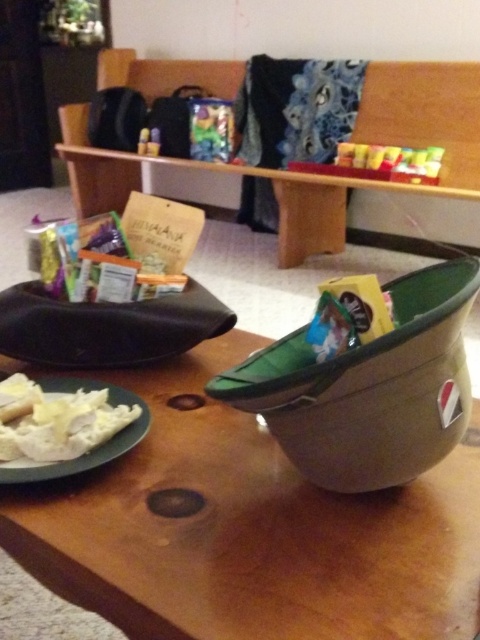
How far apart are brown matte bowl at center and matte black camera at upper center?

They are 8.12 feet apart.

Does brown matte bowl at center have a lesser width compared to matte black camera at upper center?

No.

This screenshot has height=640, width=480. What do you see at coordinates (370, 388) in the screenshot?
I see `brown matte bowl at center` at bounding box center [370, 388].

Locate an element on the screen. The width and height of the screenshot is (480, 640). brown matte bowl at center is located at coordinates (370, 388).

Does wooden table at center appear under brown matte bowl at center?

Indeed, wooden table at center is positioned under brown matte bowl at center.

Does wooden table at center lie in front of brown matte bowl at center?

Yes.

Who is more forward, (120, 528) or (259, 378)?

Point (120, 528) is more forward.

Find the location of a particular element. wooden table at center is located at coordinates (248, 531).

Which is more to the right, wooden table at center or black fabric tray at left?

wooden table at center

Is point (365, 540) more distant than point (94, 316)?

No, it is in front of (94, 316).

Where is `wooden table at center`? The width and height of the screenshot is (480, 640). wooden table at center is located at coordinates (248, 531).